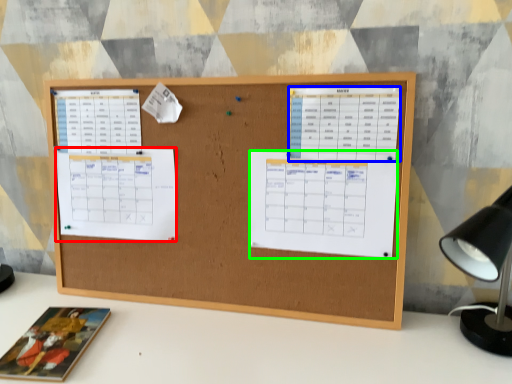
Question: Which is nearer to the list (highlighted by a red box)? list (highlighted by a blue box) or list (highlighted by a green box).

Choices:
 (A) list
 (B) list

Answer: (B)